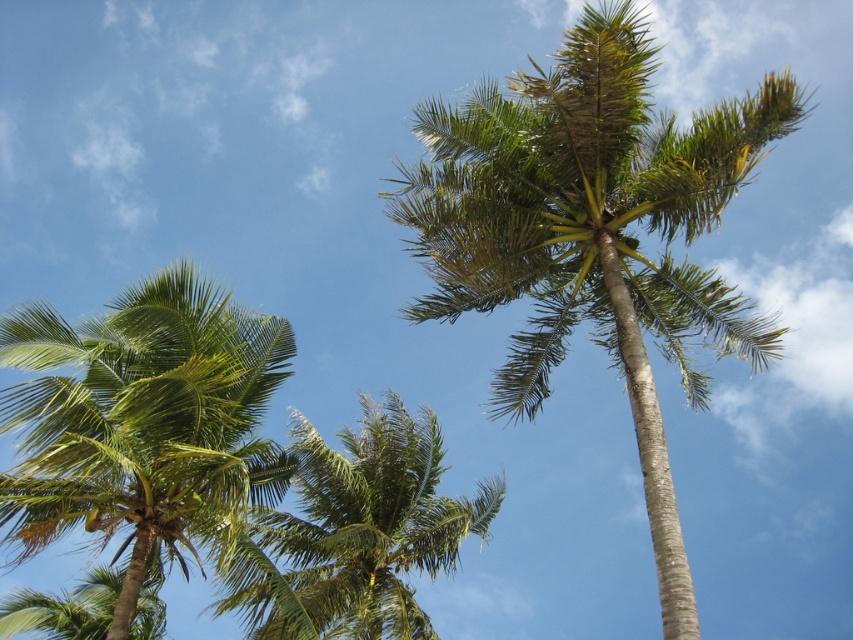
Question: Which point appears farthest from the camera in this image?

Choices:
 (A) (389, 467)
 (B) (543, 209)

Answer: (A)

Question: Estimate the real-world distances between objects in this image. Which object is farther from the green leafy palm tree at upper center?

Choices:
 (A) green leafy palm tree at left
 (B) green leafy coconut tree at center

Answer: (B)

Question: Does green leafy palm tree at upper center appear on the left side of green leafy palm tree at left?

Choices:
 (A) yes
 (B) no

Answer: (B)

Question: Does green leafy palm tree at left have a larger size compared to green leafy coconut tree at center?

Choices:
 (A) no
 (B) yes

Answer: (B)

Question: Which of the following is the closest to the observer?

Choices:
 (A) green leafy palm tree at left
 (B) green leafy palm tree at upper center
 (C) green leafy coconut tree at center

Answer: (B)

Question: Does green leafy palm tree at upper center appear over green leafy palm tree at left?

Choices:
 (A) no
 (B) yes

Answer: (B)